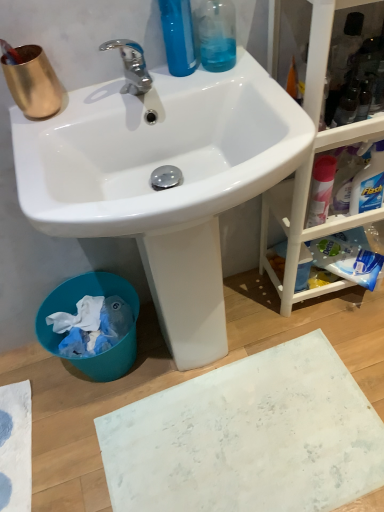
Locate an element on the screen. vacant area situated below white matte bath mat at lower center (from a real-world perspective) is located at coordinates (250, 451).